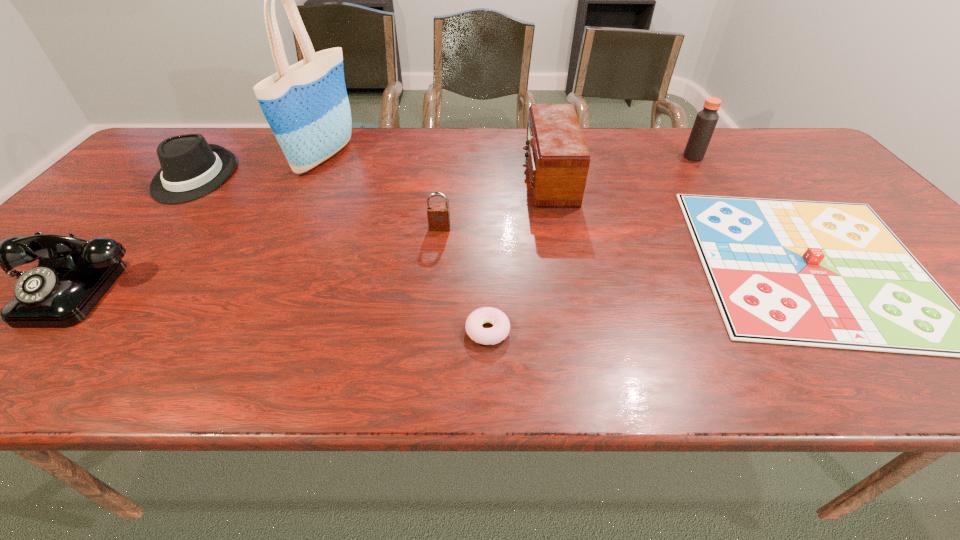
You are a GUI agent. You are given a task and a screenshot of the screen. Output one action in this format:
    pyautogui.click(x=<x>, y=<y>)
    Task: Click on the sixth object from right to left
    This screenshot has width=960, height=540.
    Given the screenshot: What is the action you would take?
    pyautogui.click(x=306, y=105)

The image size is (960, 540). What are the coordinates of `tote bag` in the screenshot? It's located at (306, 105).

Image resolution: width=960 pixels, height=540 pixels. Find the location of `vinegar`. vinegar is located at coordinates (706, 119).

Where is `radio receiver`? The height and width of the screenshot is (540, 960). radio receiver is located at coordinates (558, 159).

What are the coordinates of `the fourth object from left to right` in the screenshot? It's located at (438, 216).

This screenshot has height=540, width=960. Identify the location of fedora. (191, 168).

Locate an element on the screen. The image size is (960, 540). the fifth object from left to right is located at coordinates (501, 326).

Where is `the shortest object`? The image size is (960, 540). the shortest object is located at coordinates (501, 326).

In order to click on vacant space located on the front of the third object from left to right in this screenshot , I will do `click(295, 220)`.

The height and width of the screenshot is (540, 960). What are the coordinates of `vacant space located 0.050m on the front of the vinegar` in the screenshot? It's located at (703, 171).